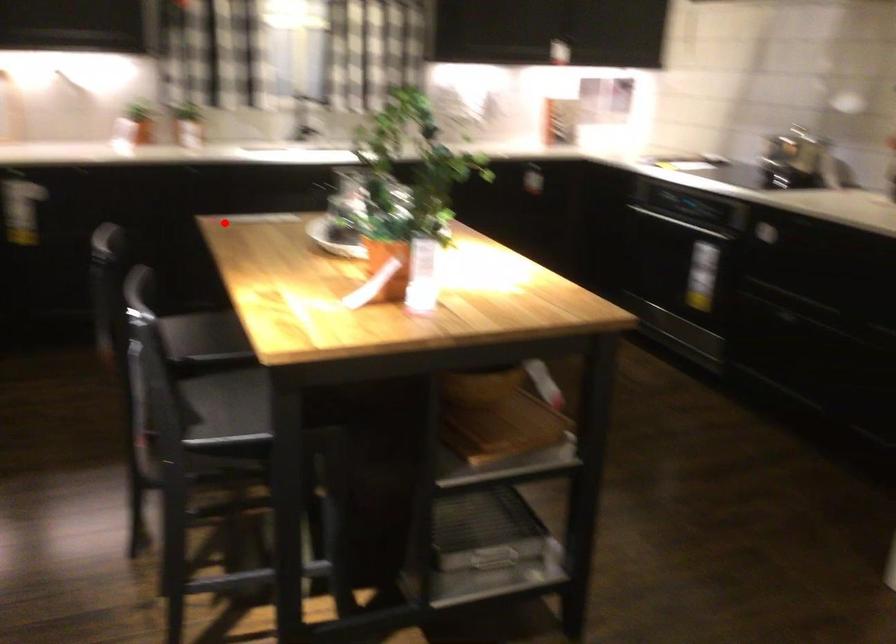
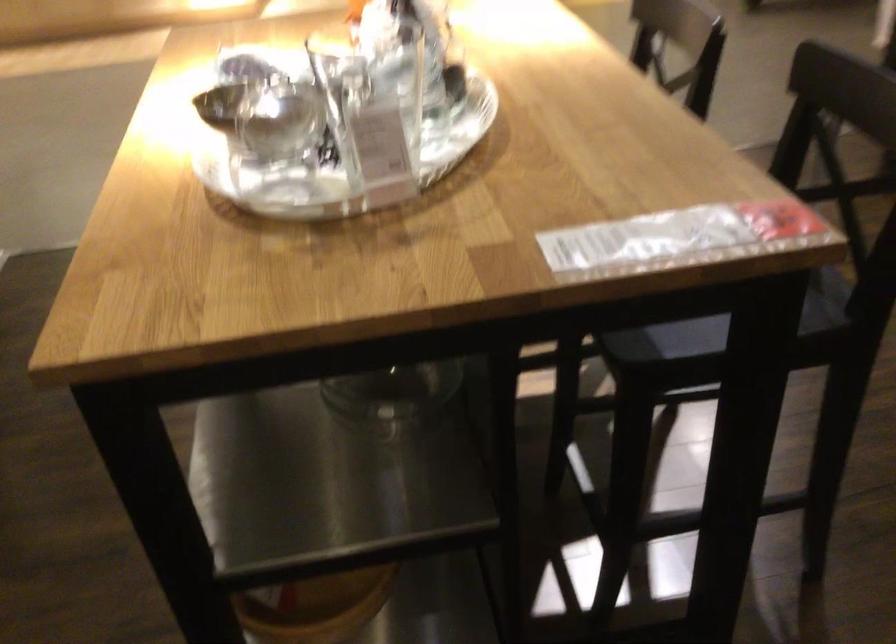
Find the pixel in the second image that matches the highlighted location in the first image.

(676, 238)